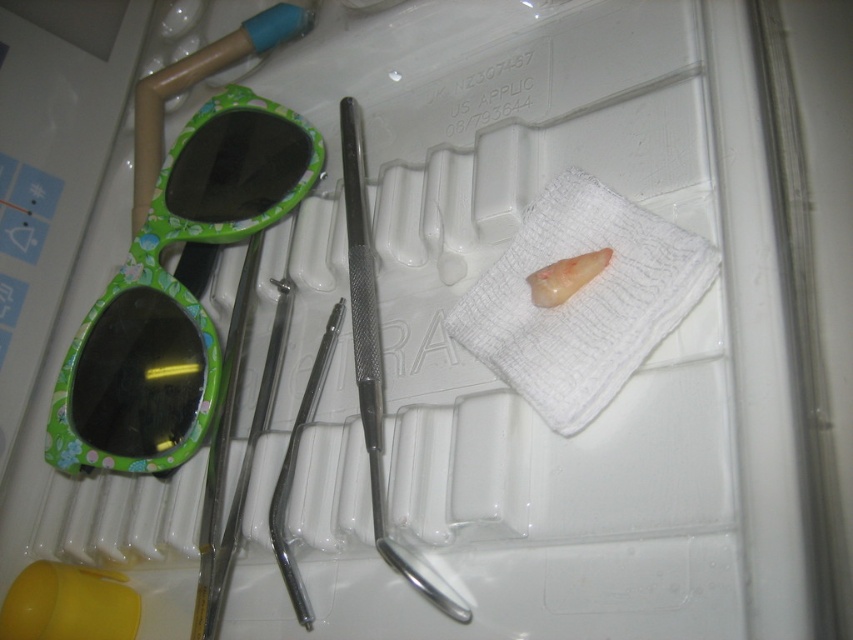
Does point (599, 278) come farther from viewer compared to point (605, 250)?

That is False.

How distant is white textured cloth at center from translucent rubber tooth at center?

The distance of white textured cloth at center from translucent rubber tooth at center is 2.09 inches.

Is point (648, 253) positioned after point (548, 275)?

No, (648, 253) is in front of (548, 275).

The image size is (853, 640). Find the location of `white textured cloth at center`. white textured cloth at center is located at coordinates (582, 300).

Does polished metal forceps at center appear over translucent rubber tooth at center?

Actually, polished metal forceps at center is below translucent rubber tooth at center.

Between polished metal forceps at center and translucent rubber tooth at center, which one appears on the right side from the viewer's perspective?

translucent rubber tooth at center is more to the right.

Between point (312, 364) and point (598, 250), which one is positioned behind?

The point (312, 364) is more distant.

Where is `polished metal forceps at center`? polished metal forceps at center is located at coordinates (294, 468).

Can you confirm if green floral plastic goggles at upper left is taller than white textured cloth at center?

Correct, green floral plastic goggles at upper left is much taller as white textured cloth at center.

What do you see at coordinates (175, 292) in the screenshot? The height and width of the screenshot is (640, 853). I see `green floral plastic goggles at upper left` at bounding box center [175, 292].

This screenshot has width=853, height=640. I want to click on green floral plastic goggles at upper left, so click(175, 292).